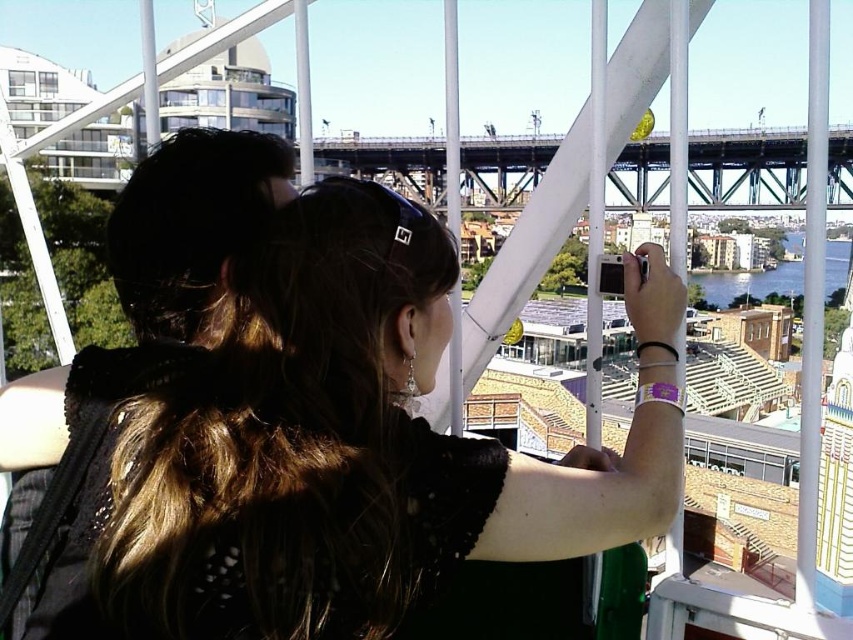
You are a photographer trying to capture both the black lace dress at center and the metallic gray bridge at center in a single frame. Given their sizes, which object will appear smaller in the photo?

The black lace dress at center will appear smaller in the photo because it has a lesser width compared to the metallic gray bridge at center.

You are a photographer trying to capture the black lace dress at center and the metallic gray bridge at center in a single frame. Based on their positions, which object is closer to the camera?

The black lace dress at center is below the metallic gray bridge at center, so the dress is closer to the camera than the bridge.

You are a photographer trying to capture a photo of the black lace dress at center and the metallic gray bridge at center. Which object should you focus on first if you want to highlight the one that is taller?

The black lace dress at center is taller than the metallic gray bridge at center, so you should focus on the black lace dress at center first to highlight its height.